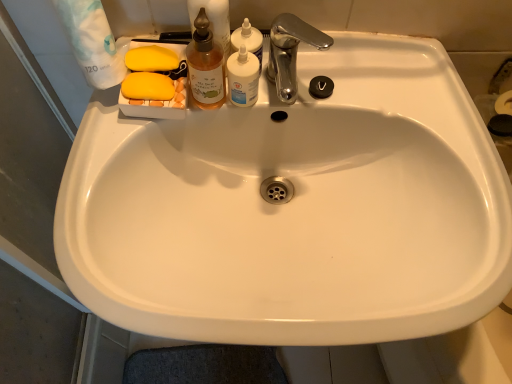
Question: From a real-world perspective, does white opaque bottle at upper center stand above chrome metallic faucet at upper center?

Choices:
 (A) yes
 (B) no

Answer: (B)

Question: Can you confirm if white opaque bottle at upper center is thinner than chrome metallic faucet at upper center?

Choices:
 (A) yes
 (B) no

Answer: (A)

Question: Can you confirm if white opaque bottle at upper center is positioned to the left of chrome metallic faucet at upper center?

Choices:
 (A) no
 (B) yes

Answer: (B)

Question: Could you tell me if white opaque bottle at upper center is turned towards chrome metallic faucet at upper center?

Choices:
 (A) yes
 (B) no

Answer: (B)

Question: From the image's perspective, is white opaque bottle at upper center under chrome metallic faucet at upper center?

Choices:
 (A) no
 (B) yes

Answer: (B)

Question: Is white opaque bottle at upper center far from chrome metallic faucet at upper center?

Choices:
 (A) no
 (B) yes

Answer: (A)

Question: Considering the relative sizes of translucent glass bottle at upper center, which appears as the 1th cleaning product when viewed from the left, and translucent plastic bottle at upper center, the second cleaning product from the left, in the image provided, is translucent glass bottle at upper center, which appears as the 1th cleaning product when viewed from the left, wider than translucent plastic bottle at upper center, the second cleaning product from the left,?

Choices:
 (A) no
 (B) yes

Answer: (A)

Question: Considering the relative sizes of translucent glass bottle at upper center, which appears as the 1th cleaning product when viewed from the left, and translucent plastic bottle at upper center, the 1th cleaning product positioned from the right, in the image provided, is translucent glass bottle at upper center, which appears as the 1th cleaning product when viewed from the left, shorter than translucent plastic bottle at upper center, the 1th cleaning product positioned from the right,?

Choices:
 (A) yes
 (B) no

Answer: (B)

Question: Is the surface of translucent glass bottle at upper center, the 2th cleaning product positioned from the right, in direct contact with translucent plastic bottle at upper center, the 1th cleaning product positioned from the right?

Choices:
 (A) yes
 (B) no

Answer: (A)

Question: Is translucent glass bottle at upper center, the 2th cleaning product positioned from the right, positioned far away from translucent plastic bottle at upper center, the second cleaning product from the left?

Choices:
 (A) no
 (B) yes

Answer: (A)

Question: From the image's perspective, would you say translucent glass bottle at upper center, the 2th cleaning product positioned from the right, is shown under translucent plastic bottle at upper center, the second cleaning product from the left?

Choices:
 (A) no
 (B) yes

Answer: (B)

Question: Does translucent glass bottle at upper center, which appears as the 1th cleaning product when viewed from the left, have a lesser width compared to translucent plastic bottle at upper center, the 1th cleaning product positioned from the right?

Choices:
 (A) yes
 (B) no

Answer: (A)

Question: Considering the relative sizes of chrome metallic faucet at upper center and translucent plastic bottle at upper center, the 1th cleaning product positioned from the right, in the image provided, is chrome metallic faucet at upper center thinner than translucent plastic bottle at upper center, the 1th cleaning product positioned from the right,?

Choices:
 (A) yes
 (B) no

Answer: (B)